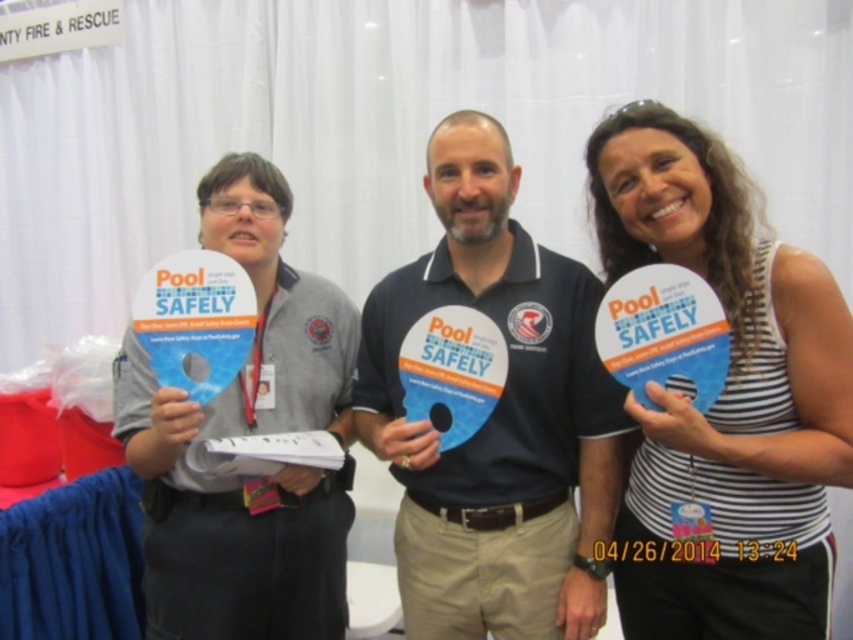
You are at an event and need to find the person wearing the white striped tank top at center. Which direction should you look relative to the person in the matte gray shirt at left?

The white striped tank top at center is to the right of the matte gray shirt at left, so you should look to the right of the matte gray shirt at left to find the person wearing the white striped tank top at center.